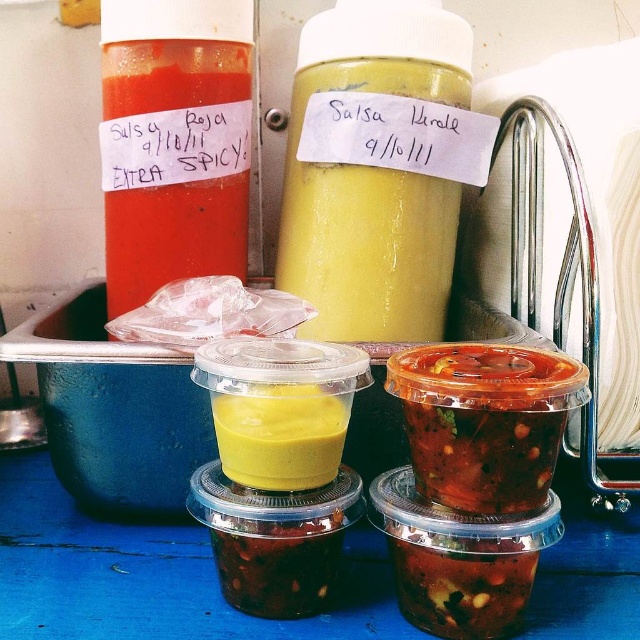
Question: Does matte plastic bottle at upper left have a lesser width compared to yellow matte plastic cup at center?

Choices:
 (A) yes
 (B) no

Answer: (B)

Question: Observing the image, what is the correct spatial positioning of shiny plastic container at center in reference to dark red glossy sauce at center?

Choices:
 (A) left
 (B) right

Answer: (B)

Question: Among these objects, which one is nearest to the camera?

Choices:
 (A) yellow matte plastic cup at center
 (B) dark red glossy sauce at center

Answer: (A)

Question: Among these points, which one is farthest from the camera?

Choices:
 (A) (284, 428)
 (B) (138, 172)
 (C) (380, 77)

Answer: (B)

Question: Which object is the farthest from the dark red glossy sauce at center?

Choices:
 (A) shiny red sauce at lower right
 (B) yellow translucent jar at center
 (C) matte plastic bottle at upper left
 (D) shiny plastic container at center

Answer: (C)

Question: Is the position of shiny red sauce at lower right more distant than that of dark red glossy sauce at center?

Choices:
 (A) no
 (B) yes

Answer: (A)